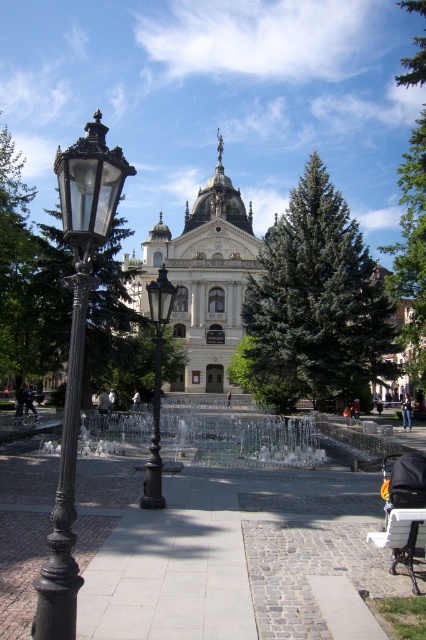
In the scene shown: Which is below, white plastic bench at lower right or matte black street light at left?

Positioned lower is white plastic bench at lower right.

Does white plastic bench at lower right have a lesser width compared to matte black street light at left?

No.

Locate an element on the screen. This screenshot has width=426, height=640. white plastic bench at lower right is located at coordinates (403, 512).

Between point (411, 369) and point (135, 401), which one is positioned in front?

Point (411, 369) is in front.

Is green textured tree at center bigger than white fabric person at center?

Yes, green textured tree at center is bigger than white fabric person at center.

Does point (420, 288) come closer to viewer compared to point (137, 396)?

Yes, it is in front of point (137, 396).

Locate an element on the screen. green textured tree at center is located at coordinates (411, 248).

From the picture: Is green textured tree at center to the left of white plastic bench at lower right from the viewer's perspective?

Incorrect, green textured tree at center is not on the left side of white plastic bench at lower right.

Is green textured tree at center thinner than white plastic bench at lower right?

No.

Does point (412, 284) come farther from viewer compared to point (385, 522)?

Yes, it is behind point (385, 522).

Locate an element on the screen. Image resolution: width=426 pixels, height=640 pixels. green textured tree at center is located at coordinates (411, 248).